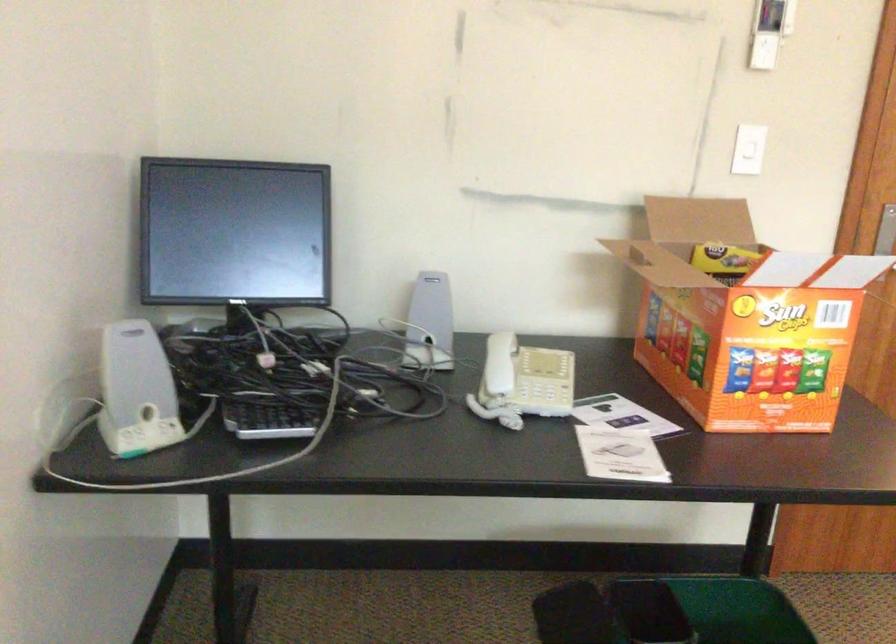
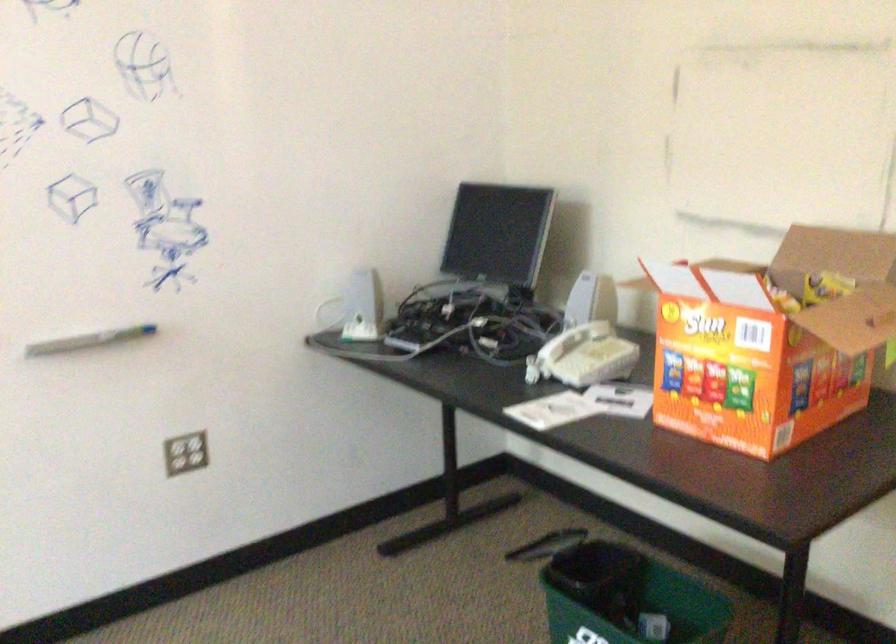
Find the pixel in the second image that matches point 701,277 in the first image.

(782, 301)